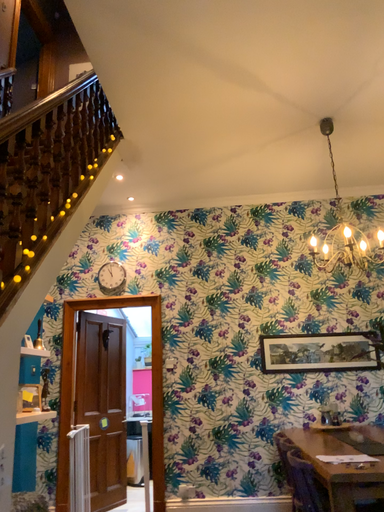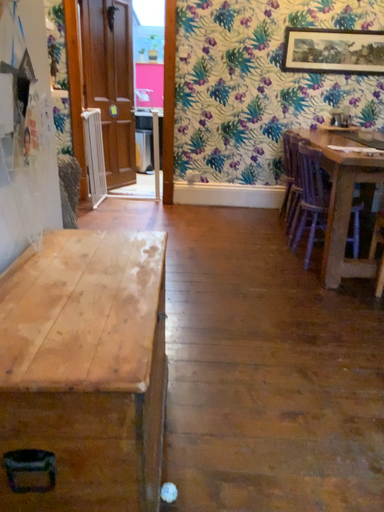
Question: How did the camera likely rotate when shooting the video?

Choices:
 (A) rotated downward
 (B) rotated upward

Answer: (A)